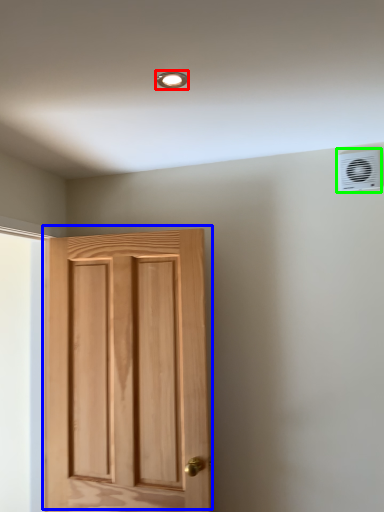
Question: Which object is the closest to the light fixture (highlighted by a red box)? Choose among these: door (highlighted by a blue box) or air conditioning (highlighted by a green box).

Choices:
 (A) door
 (B) air conditioning

Answer: (B)